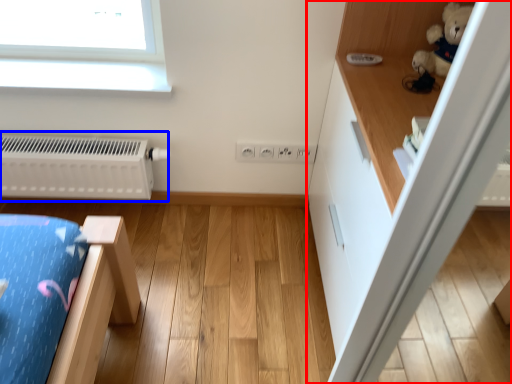
Question: Which point is further to the camera, dresser (highlighted by a red box) or radiator (highlighted by a blue box)?

Choices:
 (A) dresser
 (B) radiator

Answer: (B)